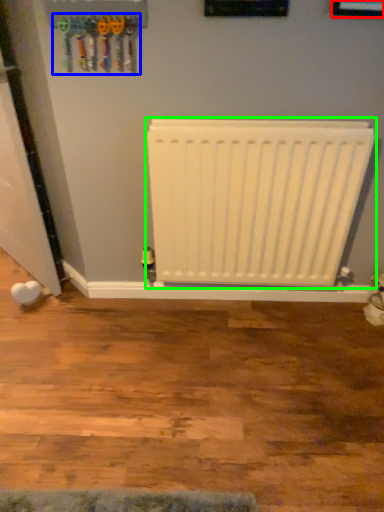
Question: Based on their relative distances, which object is farther from picture frame (highlighted by a red box)? Choose from tool (highlighted by a blue box) and radiator (highlighted by a green box).

Choices:
 (A) tool
 (B) radiator

Answer: (A)